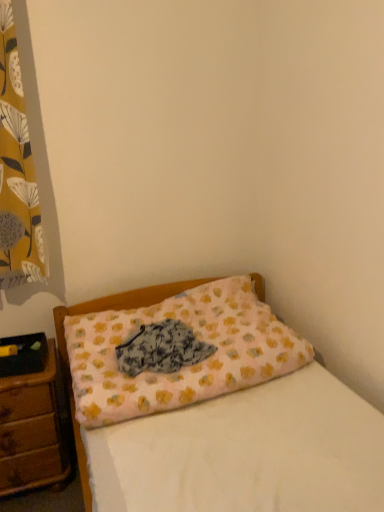
Question: Does fluffy fabric at center have a greater width compared to pink fabric pillow at center?

Choices:
 (A) no
 (B) yes

Answer: (A)

Question: Is fluffy fabric at center positioned with its back to pink fabric pillow at center?

Choices:
 (A) yes
 (B) no

Answer: (A)

Question: Are fluffy fabric at center and pink fabric pillow at center beside each other?

Choices:
 (A) yes
 (B) no

Answer: (B)

Question: Could you tell me if fluffy fabric at center is turned towards pink fabric pillow at center?

Choices:
 (A) yes
 (B) no

Answer: (A)

Question: From the image's perspective, does fluffy fabric at center appear lower than pink fabric pillow at center?

Choices:
 (A) no
 (B) yes

Answer: (B)

Question: Considering the relative positions of fluffy fabric at center and pink fabric pillow at center in the image provided, is fluffy fabric at center to the left of pink fabric pillow at center from the viewer's perspective?

Choices:
 (A) yes
 (B) no

Answer: (A)

Question: Is yellow floral fabric at left further to camera compared to brown wooden nightstand at lower left?

Choices:
 (A) yes
 (B) no

Answer: (B)

Question: From the image's perspective, is yellow floral fabric at left over brown wooden nightstand at lower left?

Choices:
 (A) yes
 (B) no

Answer: (A)

Question: From a real-world perspective, does yellow floral fabric at left sit lower than brown wooden nightstand at lower left?

Choices:
 (A) no
 (B) yes

Answer: (A)

Question: From a real-world perspective, does yellow floral fabric at left stand above brown wooden nightstand at lower left?

Choices:
 (A) yes
 (B) no

Answer: (A)

Question: Would you say brown wooden nightstand at lower left is part of yellow floral fabric at left's contents?

Choices:
 (A) yes
 (B) no

Answer: (B)

Question: Can we say yellow floral fabric at left lies outside brown wooden nightstand at lower left?

Choices:
 (A) yes
 (B) no

Answer: (A)

Question: Is brown wooden nightstand at lower left completely or partially outside of pink fabric pillow at center?

Choices:
 (A) no
 (B) yes

Answer: (B)